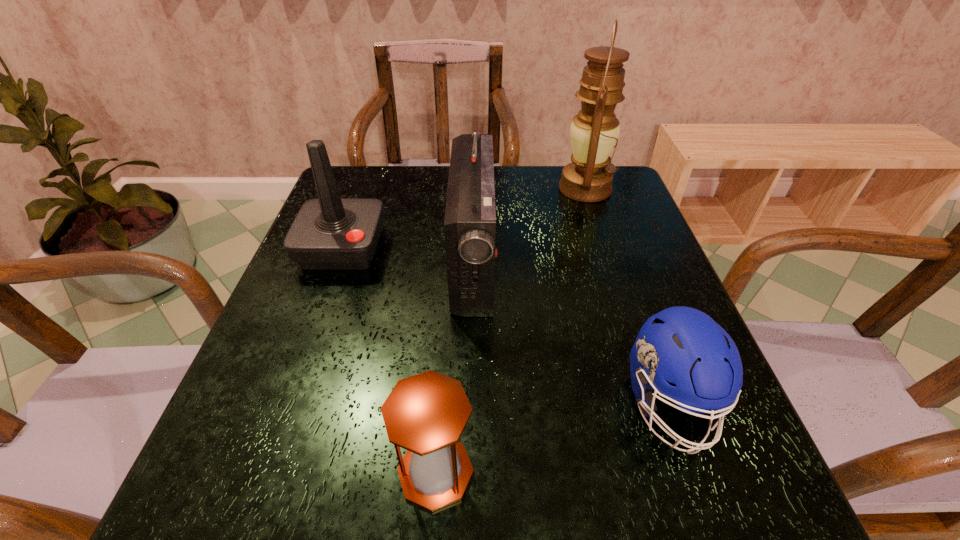
The width and height of the screenshot is (960, 540). Find the location of `vacant space located 0.360m on the back of the hourglass`. vacant space located 0.360m on the back of the hourglass is located at coordinates (450, 278).

Where is `object positioned at the far edge`? The width and height of the screenshot is (960, 540). object positioned at the far edge is located at coordinates (594, 131).

Where is `football helmet located in the near edge section of the desktop`? football helmet located in the near edge section of the desktop is located at coordinates (682, 345).

What are the coordinates of `hourglass positioned at the near edge` in the screenshot? It's located at (426, 414).

Where is `object that is at the left edge`? Image resolution: width=960 pixels, height=540 pixels. object that is at the left edge is located at coordinates (329, 233).

You are a GUI agent. You are given a task and a screenshot of the screen. Output one action in this format:
    pyautogui.click(x=<x>, y=<y>)
    Task: Click on the oil lamp that is positioned at the right edge
    The width and height of the screenshot is (960, 540).
    Given the screenshot: What is the action you would take?
    pyautogui.click(x=594, y=131)

Where is `football helmet present at the right edge`? football helmet present at the right edge is located at coordinates (682, 345).

The image size is (960, 540). I want to click on object present at the far right corner, so click(x=594, y=131).

What are the coordinates of `object situated at the near right corner` in the screenshot? It's located at (682, 345).

You are a GUI agent. You are given a task and a screenshot of the screen. Output one action in this format:
    pyautogui.click(x=<x>, y=<y>)
    Task: Click on the vacant space at the far edge of the desktop
    The image size is (960, 540).
    Given the screenshot: What is the action you would take?
    pyautogui.click(x=504, y=168)